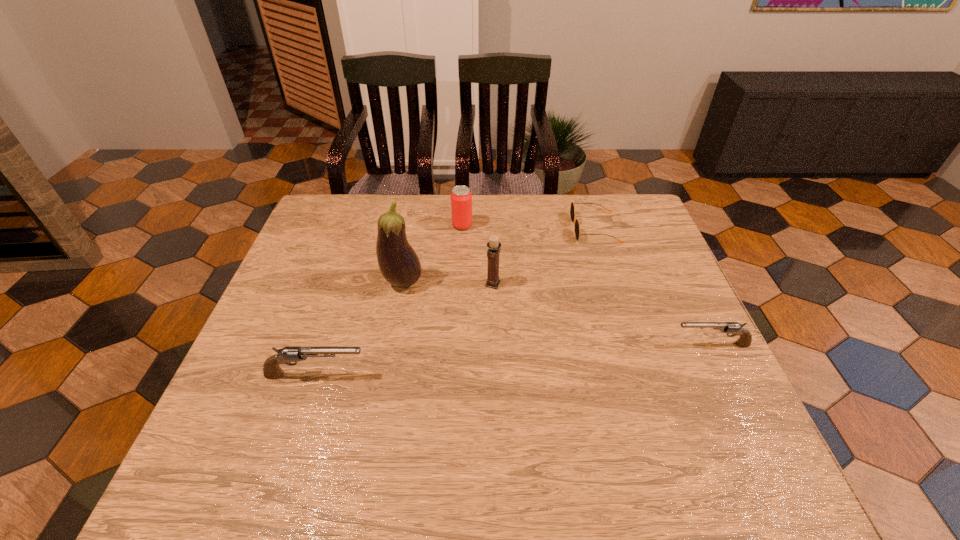
Locate an element on the screen. free space at the right edge of the desktop is located at coordinates (650, 268).

In the image, there is a desktop. Where is `free region at the far left corner`? free region at the far left corner is located at coordinates (352, 215).

The width and height of the screenshot is (960, 540). I want to click on free space at the far right corner, so click(636, 208).

Where is `free area in between the fourth tallest object and the tallest object`? The height and width of the screenshot is (540, 960). free area in between the fourth tallest object and the tallest object is located at coordinates (359, 328).

At what (x,y) coordinates should I click in order to perform the action: click on free spot between the farther gun and the third tallest object. Please return your answer as a coordinate pair (x, y). Looking at the image, I should click on (587, 285).

Where is `empty location between the shortest object and the taller gun`? This screenshot has height=540, width=960. empty location between the shortest object and the taller gun is located at coordinates [x=455, y=302].

Image resolution: width=960 pixels, height=540 pixels. Identify the location of vacant area between the eggplant and the fourth object from right to left. (432, 254).

Identify the location of free spot between the third tallest object and the tallest object. (432, 254).

At what (x,y) coordinates should I click in order to perform the action: click on free point between the third object from left to right and the sunglasses. Please return your answer as a coordinate pair (x, y). Looking at the image, I should click on (528, 227).

At what (x,y) coordinates should I click in order to perform the action: click on vacant space that's between the nearest object and the fourth object from left to right. Please return your answer as a coordinate pair (x, y). Looking at the image, I should click on (404, 329).